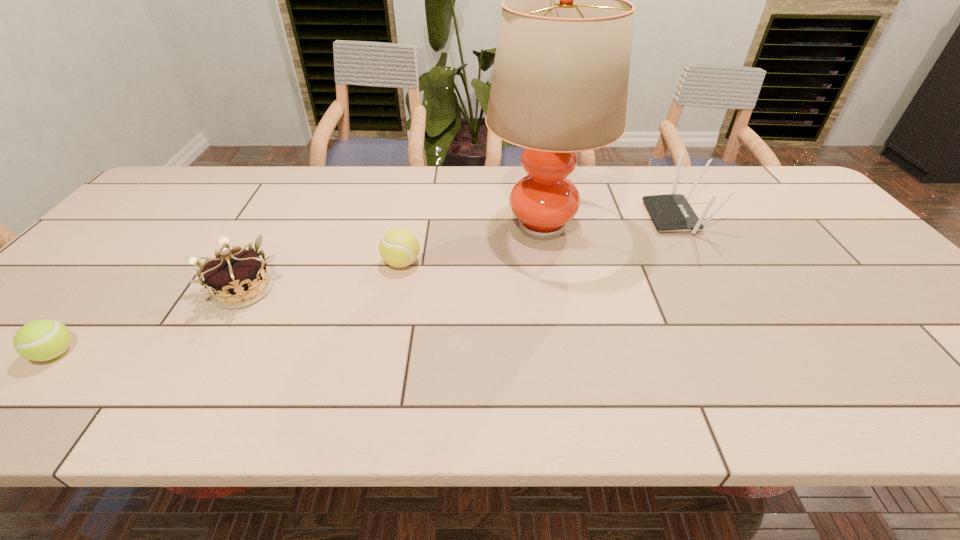
In the image, there is a desktop. In order to click on vacant space at the near edge in this screenshot , I will do `click(468, 390)`.

In the image, there is a desktop. Where is `vacant region at the left edge`? The height and width of the screenshot is (540, 960). vacant region at the left edge is located at coordinates (116, 244).

Find the location of `free location at the right edge of the desktop`. free location at the right edge of the desktop is located at coordinates (900, 293).

In the image, there is a desktop. Identify the location of vacant space at the far right corner. coord(772,166).

This screenshot has height=540, width=960. I want to click on free space between the lamp and the taller tennis ball, so click(x=472, y=245).

Locate an element on the screen. This screenshot has width=960, height=540. free spot between the second object from left to right and the left tennis ball is located at coordinates (150, 321).

This screenshot has width=960, height=540. What are the coordinates of `unoccupied area between the fourth object from right to left and the router` in the screenshot? It's located at (460, 253).

The image size is (960, 540). What are the coordinates of `free space between the second object from right to left and the nearest object` in the screenshot? It's located at (300, 290).

Identify the location of vacant space in between the router and the third tallest object. (460, 253).

I want to click on free spot between the leftmost object and the second object from left to right, so click(x=150, y=321).